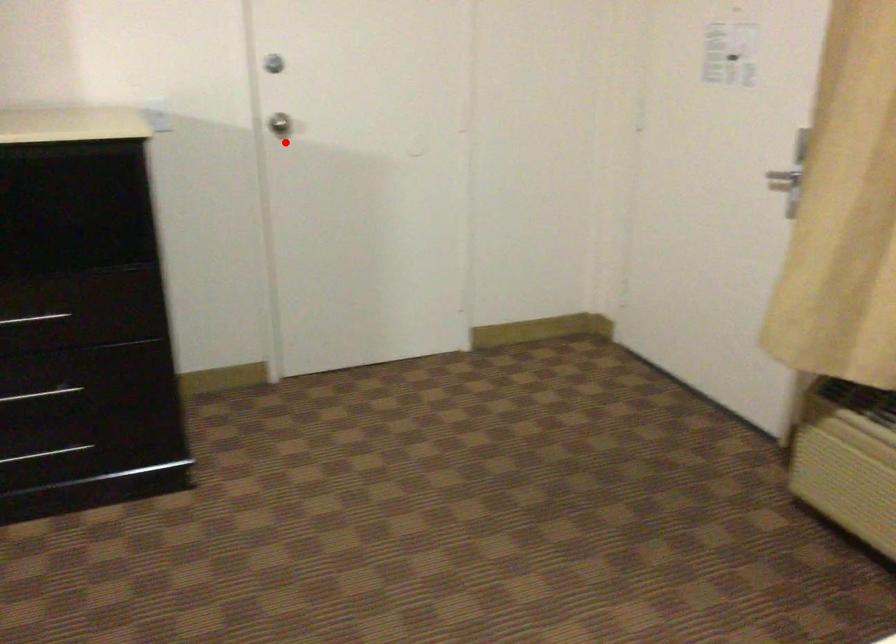
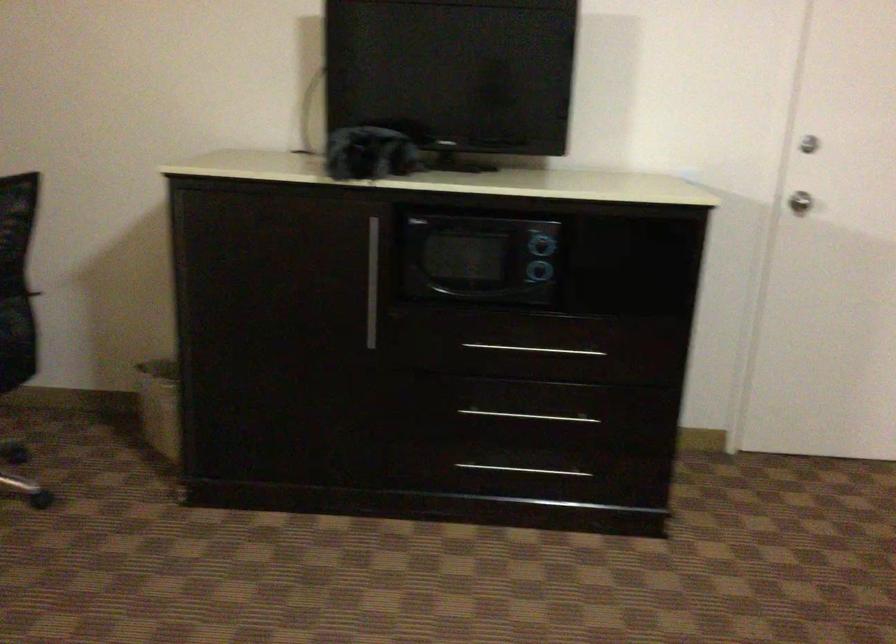
Find the pixel in the second image that matches the highlighted location in the first image.

(799, 202)